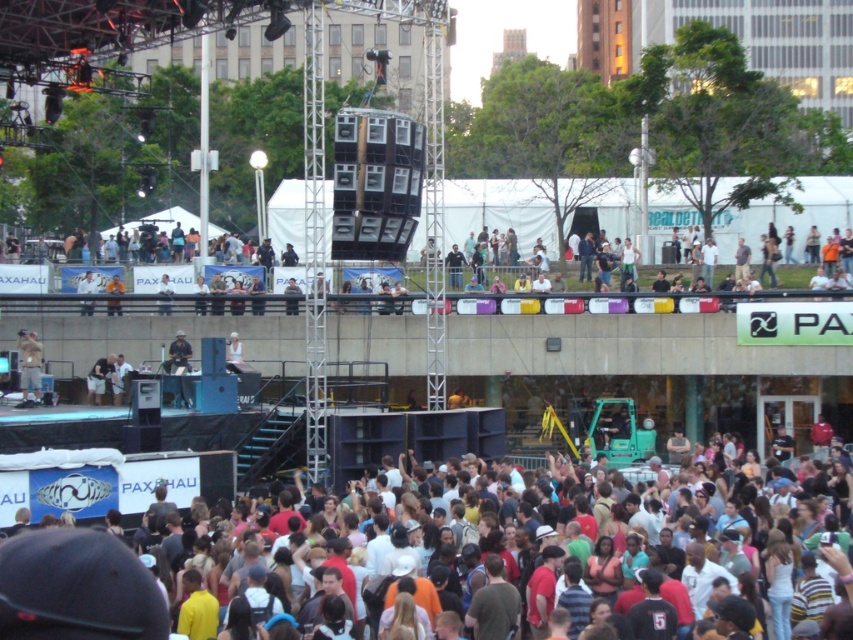
Based on the photo, you are standing at the point with coordinates (x=28, y=365) in the image. What object is located at that point?

The point at coordinates (x=28, y=365) indicates the location of the light brown leather jacket at lower left.

You are a photographer trying to capture a photo of the light brown leather jacket at center without including the multicolored casual attire at lower center. Given their sizes, is this possible?

The multicolored casual attire at lower center is wider than the light brown leather jacket at center. Therefore, it might be challenging to frame the photo so that the light brown leather jacket at center is visible without the multicolored casual attire at lower center overlapping, especially if they are positioned close to each other in the scene.